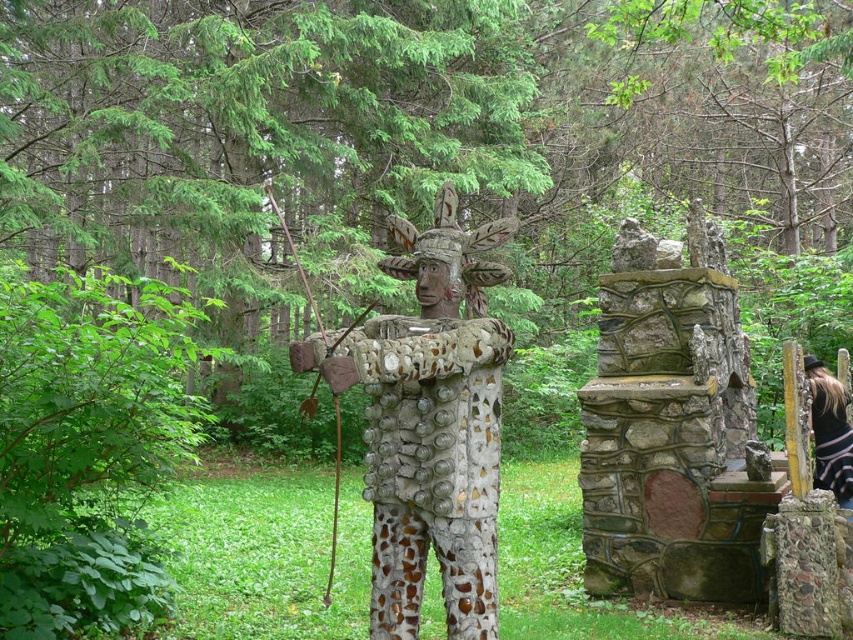
In the scene shown: You are a photographer trying to capture the sculpture and the stone structure in the forest scene. You notice two points marked in the image at coordinates point [374,403] and point [824,440]. Which point should you focus on first if you want to ensure both the sculpture and the stone structure are in sharp focus?

You should focus on point [374,403] first because it is closer to the camera than point [824,440]. This ensures the sculpture and stone structure are in focus as the depth of field will cover both when focusing on the closer point.

You are an archaeologist examining the forest scene. You notice a specific point at coordinates (428, 422). Based on the scene description, can you determine what object this point is located on?

The point at coordinates (428, 422) is located on the polished stone statue at center.